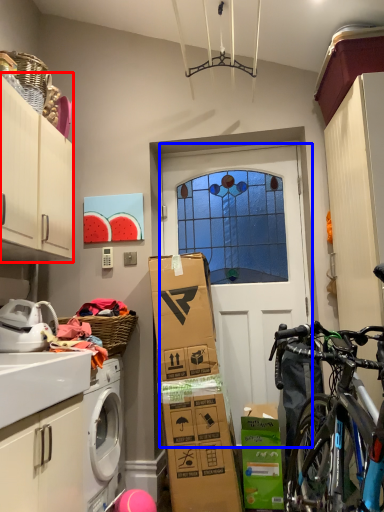
Question: Which object appears closest to the camera in this image, cabinetry (highlighted by a red box) or door (highlighted by a blue box)?

Choices:
 (A) cabinetry
 (B) door

Answer: (A)